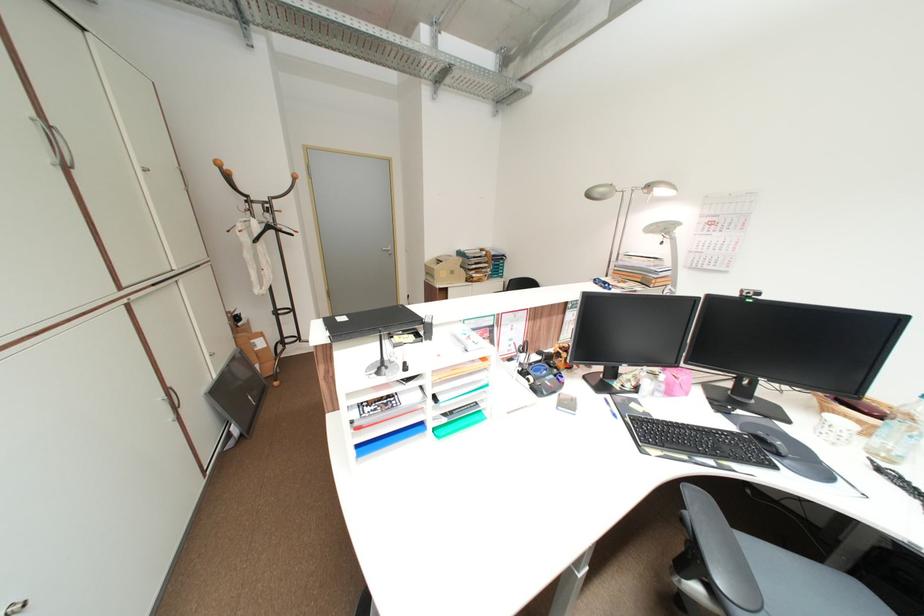
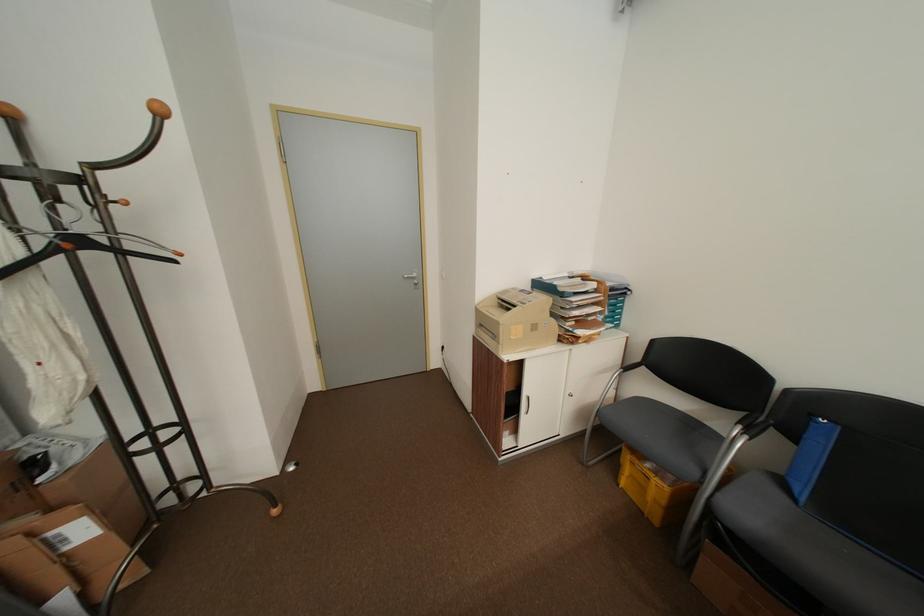
Question: In a continuous first-person perspective shot, in which direction is the camera moving?

Choices:
 (A) Left
 (B) Right
 (C) Forward
 (D) Backward

Answer: (C)